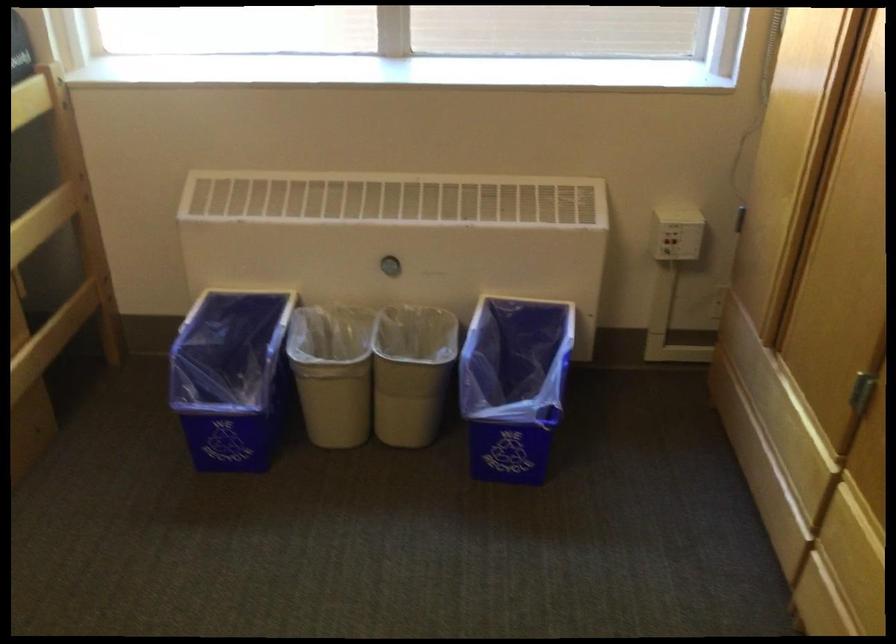
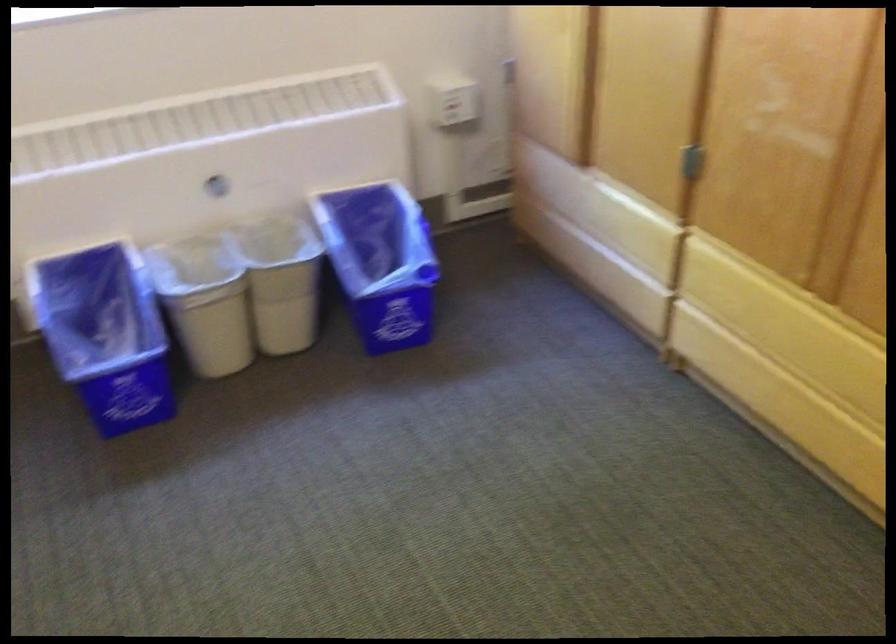
Find the pixel in the second image that matches [250,372] in the first image.

(105, 334)